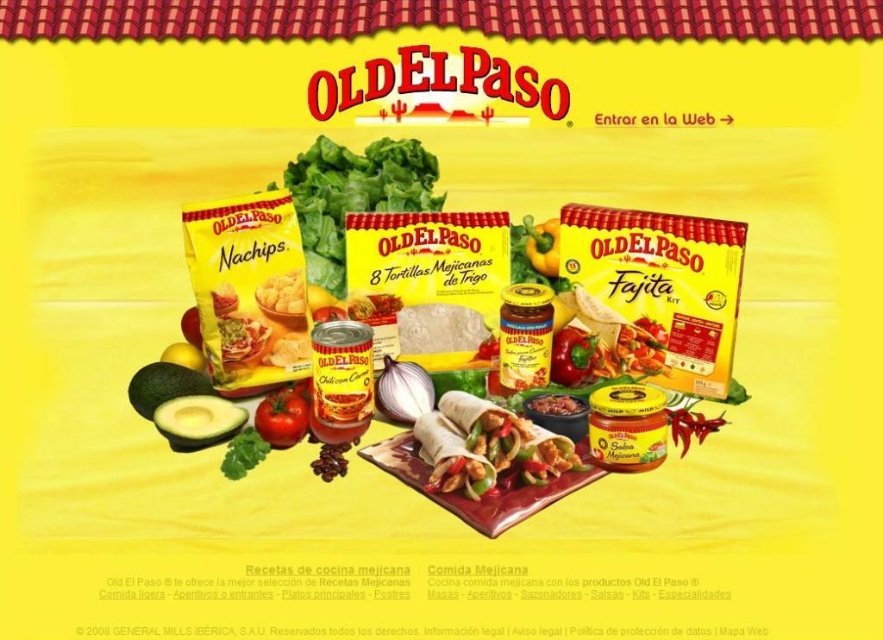
Question: Which point is closer to the camera?

Choices:
 (A) yellow glass jar at center
 (B) green leafy at center
 (C) red glossy bell pepper at center

Answer: (B)

Question: Which point appears closest to the camera in this image?

Choices:
 (A) (509, 348)
 (B) (587, 336)
 (C) (266, 435)
 (D) (274, 312)

Answer: (C)

Question: Among these objects, which one is farthest from the camera?

Choices:
 (A) red smooth tomato at center
 (B) yellow matte tortilla at center

Answer: (A)

Question: Is white matte onion at center below red glossy bell pepper at center?

Choices:
 (A) no
 (B) yes

Answer: (B)

Question: Does green matte avocado at center-left appear under matte yellow chips at center?

Choices:
 (A) no
 (B) yes

Answer: (B)

Question: Is green matte avocado at center-left smaller than green leafy at center?

Choices:
 (A) no
 (B) yes

Answer: (A)